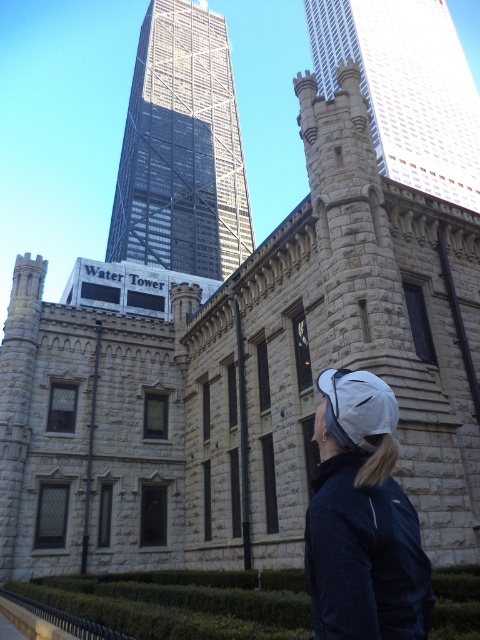
Question: Which of the following is the closest to the observer?

Choices:
 (A) (224, 156)
 (B) (315, 433)
 (C) (309, 29)

Answer: (B)

Question: Is reflective glass skyscraper at upper center behind stone turret at upper center?

Choices:
 (A) yes
 (B) no

Answer: (A)

Question: From the image, what is the correct spatial relationship of reflective glass skyscraper at upper center in relation to stone turret at upper center?

Choices:
 (A) below
 (B) above

Answer: (A)

Question: Which object appears farthest from the camera in this image?

Choices:
 (A) white matte cap at upper center
 (B) reflective glass skyscraper at upper center
 (C) stone turret at upper center

Answer: (B)

Question: Which object appears farthest from the camera in this image?

Choices:
 (A) white matte cap at upper center
 (B) reflective glass skyscraper at upper center
 (C) stone turret at upper center

Answer: (B)

Question: Is reflective glass skyscraper at upper center smaller than white matte cap at upper center?

Choices:
 (A) no
 (B) yes

Answer: (A)